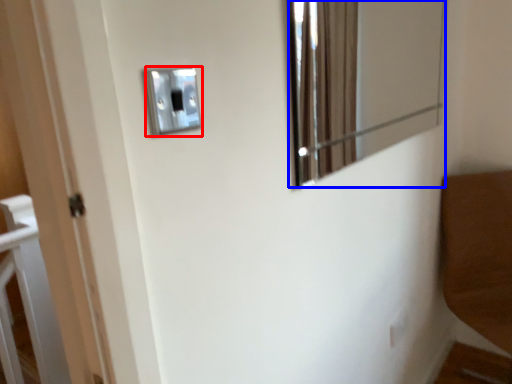
Question: Which object appears closest to the camera in this image, light switch (highlighted by a red box) or mirror (highlighted by a blue box)?

Choices:
 (A) light switch
 (B) mirror

Answer: (A)